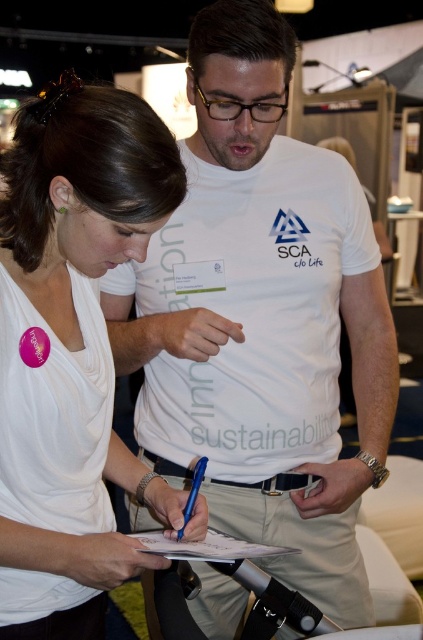
Question: Does white cotton t-shirt at center appear under blue metallic pen at center?

Choices:
 (A) yes
 (B) no

Answer: (B)

Question: Is white cotton t-shirt at center above white matte shirt at center?

Choices:
 (A) no
 (B) yes

Answer: (B)

Question: Based on their relative distances, which object is nearer to the white paper at center?

Choices:
 (A) white cotton t-shirt at center
 (B) white matte shirt at center
 (C) blue metallic pen at center

Answer: (C)

Question: Is white paper at center bigger than blue metallic pen at center?

Choices:
 (A) no
 (B) yes

Answer: (B)

Question: Which object is the farthest from the white cotton t-shirt at center?

Choices:
 (A) blue metallic pen at center
 (B) white matte shirt at center
 (C) white paper at center

Answer: (A)

Question: Which object is farther from the camera taking this photo?

Choices:
 (A) white matte shirt at center
 (B) white cotton t-shirt at center
 (C) white paper at center

Answer: (B)